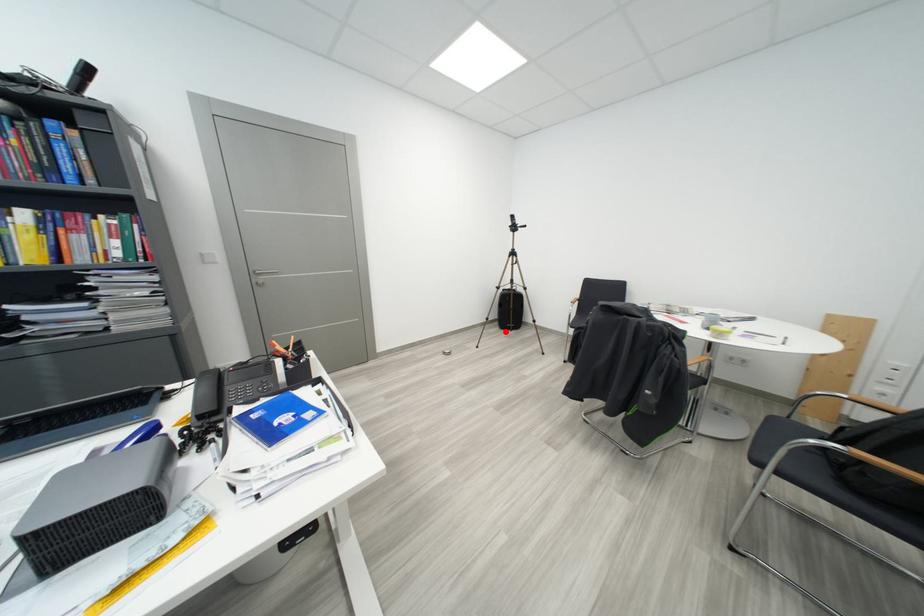
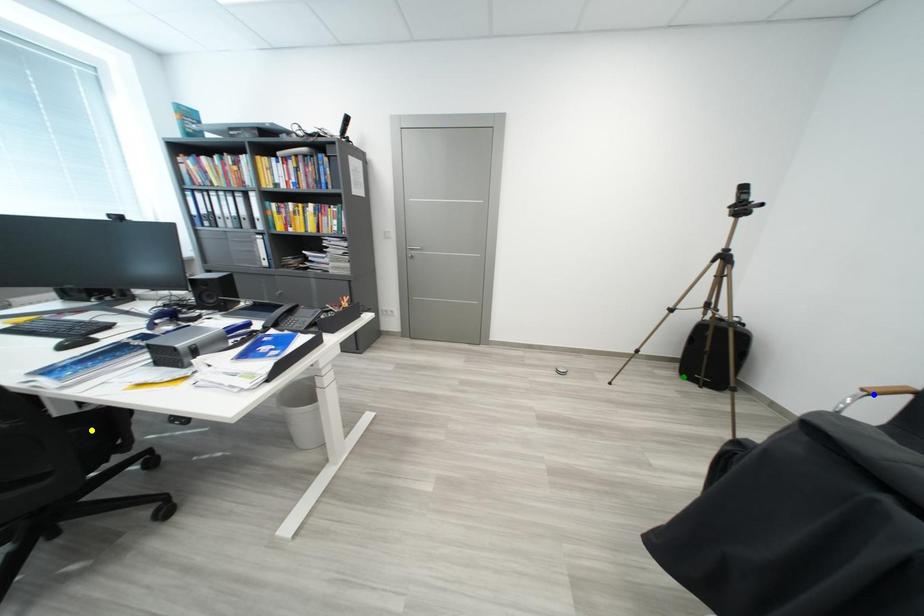
Question: I am providing you with two images of the same scene from different viewpoints. A red point is marked on the first image. You are given multiple points on the second image. Which mark in image 2 goes with the point in image 1?

Choices:
 (A) blue point
 (B) green point
 (C) yellow point

Answer: (B)